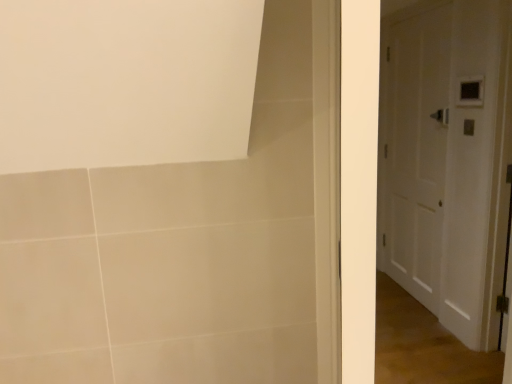
Describe the element at coordinates (447, 159) in the screenshot. I see `white wooden door at right` at that location.

Identify the location of white wooden door at right. (447, 159).

Image resolution: width=512 pixels, height=384 pixels. I want to click on white wooden door at right, so click(x=447, y=159).